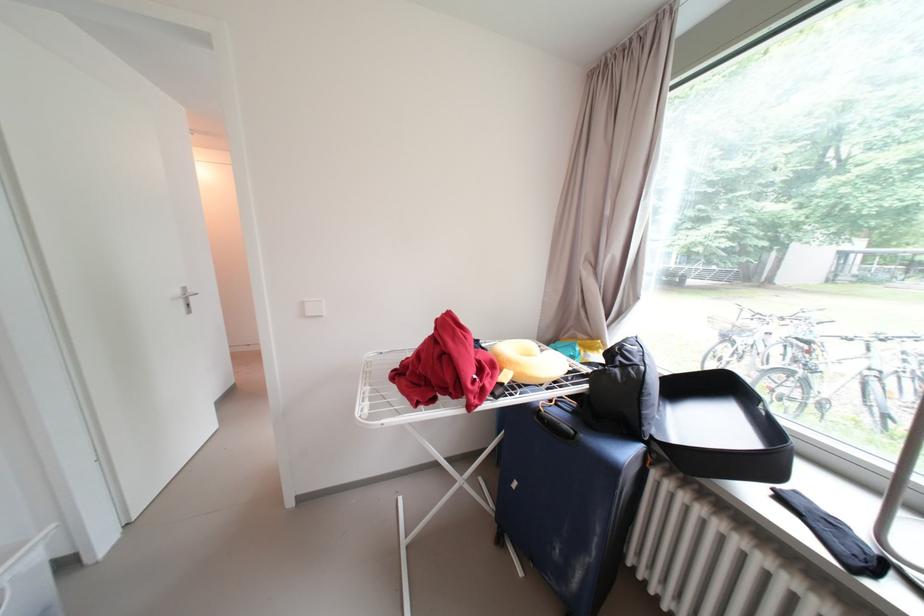
Find where to push the metal door handle. Please return your answer as a coordinate pair (x, y).

(187, 294)